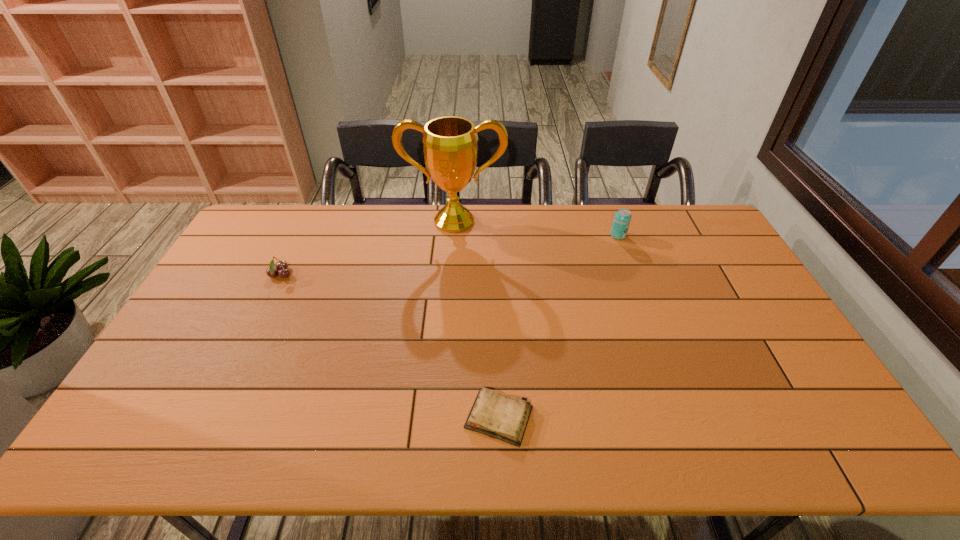
Locate an element on the screen. The width and height of the screenshot is (960, 540). free space that satisfies the following two spatial constraints: 1. on the leaves of the nearest object; 2. on the left side of the third farthest object is located at coordinates [212, 417].

At what (x,y) coordinates should I click in order to perform the action: click on free space that satisfies the following two spatial constraints: 1. on the front-facing side of the award; 2. on the left side of the diary. Please return your answer as a coordinate pair (x, y). The width and height of the screenshot is (960, 540). Looking at the image, I should click on (440, 417).